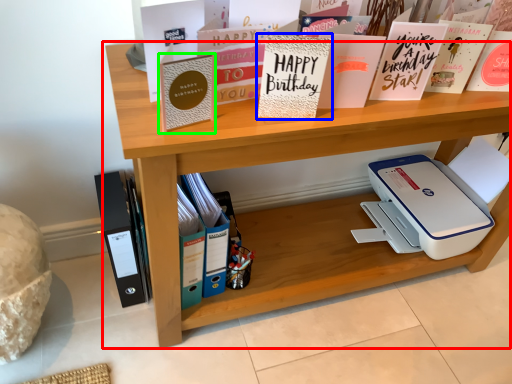
Question: Estimate the real-world distances between objects in this image. Which object is closer to shelf (highlighted by a red box), paperback book (highlighted by a blue box) or paperback book (highlighted by a green box)?

Choices:
 (A) paperback book
 (B) paperback book

Answer: (A)